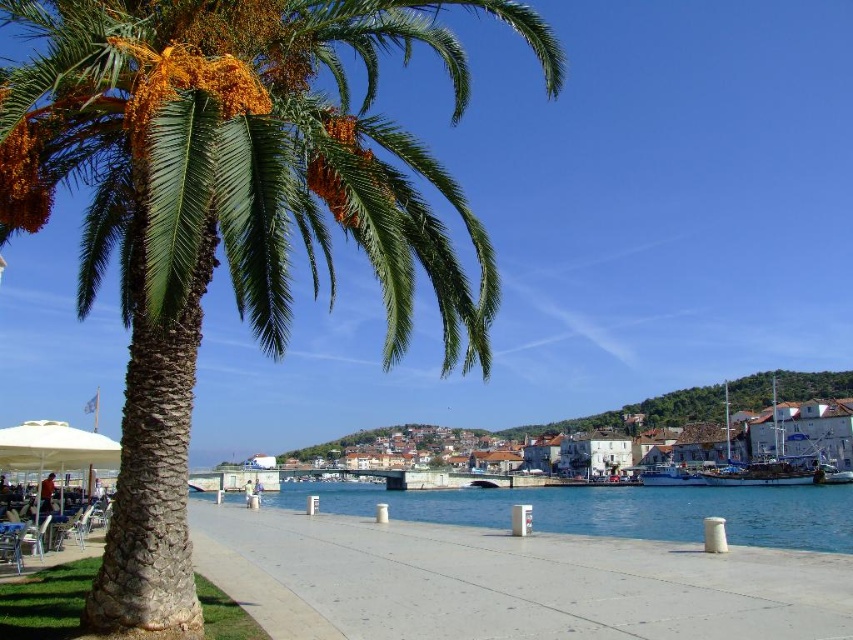
Question: Does clear blue water at lower center come in front of white fabric umbrella at lower left?

Choices:
 (A) yes
 (B) no

Answer: (B)

Question: Among these objects, which one is farthest from the camera?

Choices:
 (A) concrete at center
 (B) green leafy palm tree at left

Answer: (A)

Question: Among these points, which one is farthest from the camera?

Choices:
 (A) (431, 211)
 (B) (0, 433)
 (C) (526, 563)

Answer: (C)

Question: Can you confirm if green leafy palm tree at left is smaller than white stone buildings at center?

Choices:
 (A) no
 (B) yes

Answer: (B)

Question: Estimate the real-world distances between objects in this image. Which object is farther from the white fabric umbrella at lower left?

Choices:
 (A) concrete at center
 (B) green leafy palm tree at left
 (C) white stone buildings at center
 (D) clear blue water at lower center

Answer: (C)

Question: Does concrete at center appear on the left side of clear blue water at lower center?

Choices:
 (A) no
 (B) yes

Answer: (B)